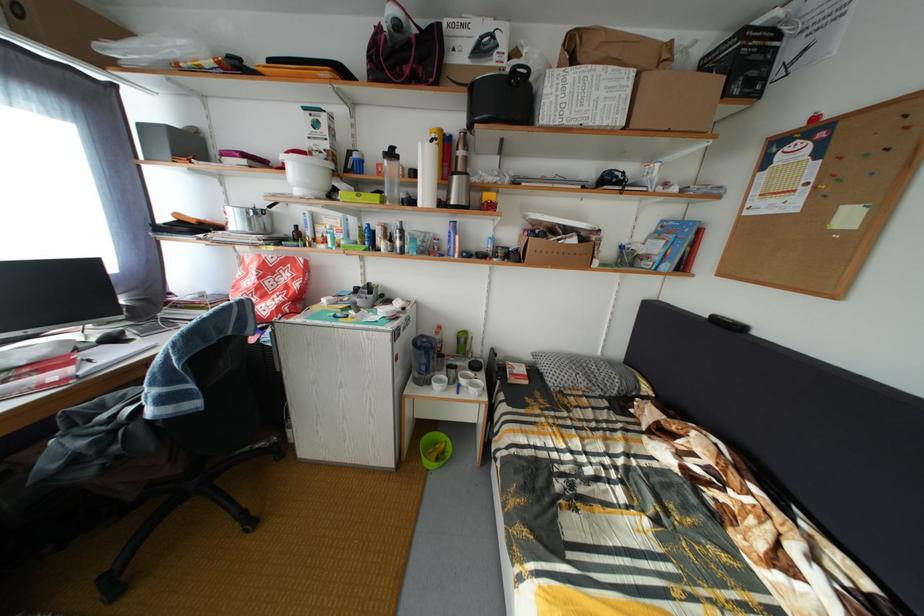
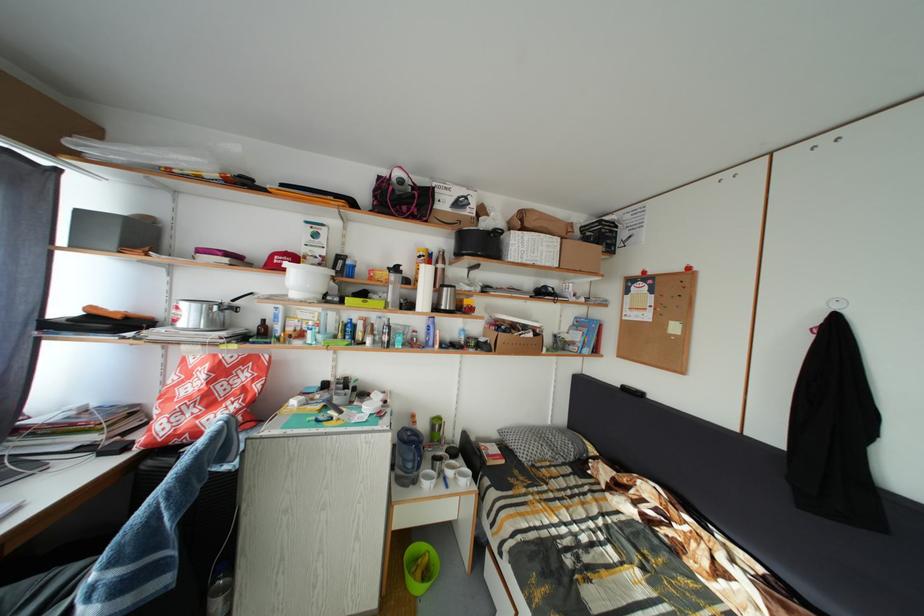
In the second image, find the point that corresponds to point (471, 389) in the first image.

(458, 480)